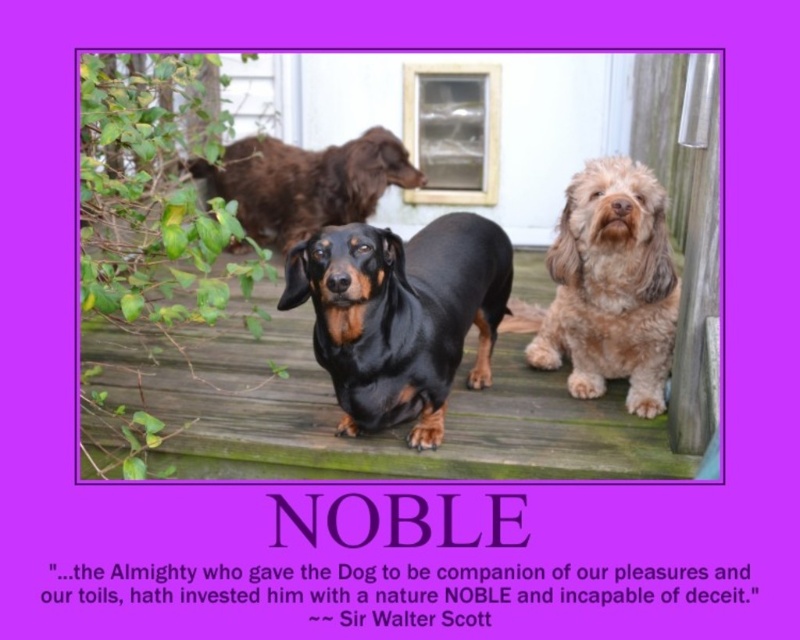
Does black shiny dachshund at center appear over shiny brown fur at upper center?

→ No.

Where is `black shiny dachshund at center`? black shiny dachshund at center is located at coordinates (400, 316).

Where is `black shiny dachshund at center`? The image size is (800, 640). black shiny dachshund at center is located at coordinates (400, 316).

Which of these two, fuzzy brown dog at center or shiny brown fur at upper center, stands taller?

fuzzy brown dog at center is taller.

Can you confirm if fuzzy brown dog at center is smaller than shiny brown fur at upper center?

Actually, fuzzy brown dog at center might be larger than shiny brown fur at upper center.

The width and height of the screenshot is (800, 640). What do you see at coordinates (609, 285) in the screenshot?
I see `fuzzy brown dog at center` at bounding box center [609, 285].

Image resolution: width=800 pixels, height=640 pixels. I want to click on fuzzy brown dog at center, so click(609, 285).

Is point (302, 278) positioned before point (605, 342)?

Yes.

Which of these two, black shiny dachshund at center or fuzzy brown dog at center, stands taller?

With more height is fuzzy brown dog at center.

The width and height of the screenshot is (800, 640). Find the location of `black shiny dachshund at center`. black shiny dachshund at center is located at coordinates (400, 316).

Identify the location of black shiny dachshund at center. (400, 316).